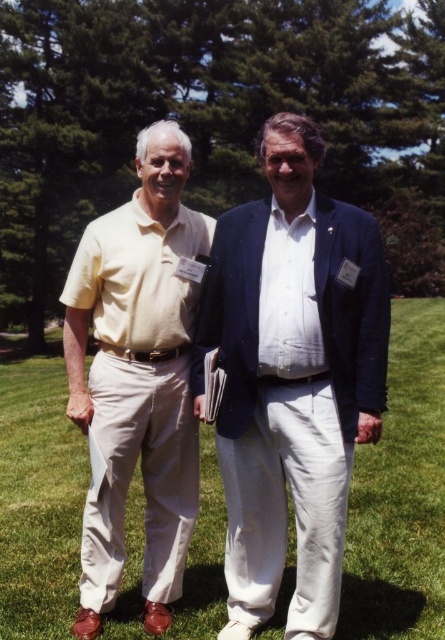
Question: Which point is closer to the camera?

Choices:
 (A) matte yellow shirt at center
 (B) matte yellow shirt at left

Answer: (A)

Question: Which of the following is the closest to the observer?

Choices:
 (A) matte yellow shirt at left
 (B) matte yellow shirt at center

Answer: (B)

Question: Does matte yellow shirt at center have a greater width compared to matte yellow shirt at left?

Choices:
 (A) yes
 (B) no

Answer: (B)

Question: Is matte yellow shirt at center to the right of matte yellow shirt at left from the viewer's perspective?

Choices:
 (A) no
 (B) yes

Answer: (B)

Question: Which point is farther to the camera?

Choices:
 (A) matte yellow shirt at left
 (B) matte yellow shirt at center

Answer: (A)

Question: Is matte yellow shirt at center positioned before matte yellow shirt at left?

Choices:
 (A) yes
 (B) no

Answer: (A)